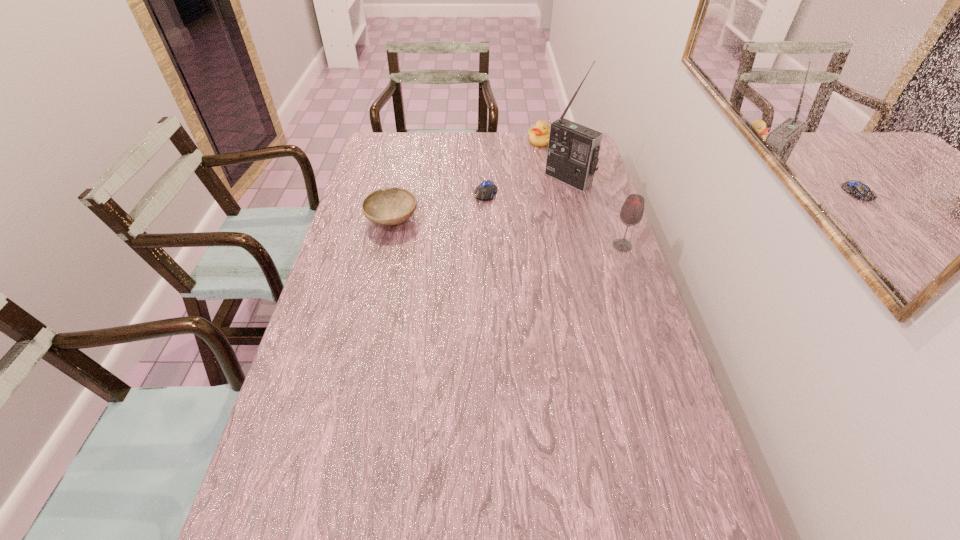
The image size is (960, 540). I want to click on vacant space at the far left corner of the desktop, so click(409, 145).

Where is `free space between the radio receiver and the fourth shortest object`? This screenshot has width=960, height=540. free space between the radio receiver and the fourth shortest object is located at coordinates (595, 213).

At what (x,y) coordinates should I click in order to perform the action: click on free point between the second object from left to right and the fourth shortest object. Please return your answer as a coordinate pair (x, y). Looking at the image, I should click on (554, 219).

Image resolution: width=960 pixels, height=540 pixels. In order to click on unoccupied area between the glass drink container and the second object from left to right in this screenshot , I will do `click(554, 219)`.

Image resolution: width=960 pixels, height=540 pixels. What are the coordinates of `free space between the bowl and the farthest object` in the screenshot? It's located at (467, 180).

The image size is (960, 540). Identify the location of empty space between the computer mouse and the third tallest object. (514, 167).

Identify the location of free space between the farthest object and the bowl. (467, 180).

In order to click on free space between the radio receiver and the shortest object in this screenshot , I will do `click(527, 186)`.

Locate an element on the screen. Image resolution: width=960 pixels, height=540 pixels. object that is the fourth nearest to the bowl is located at coordinates (631, 213).

At what (x,y) coordinates should I click in order to perform the action: click on object identified as the closest to the bowl. Please return your answer as a coordinate pair (x, y). The image size is (960, 540). Looking at the image, I should click on (485, 191).